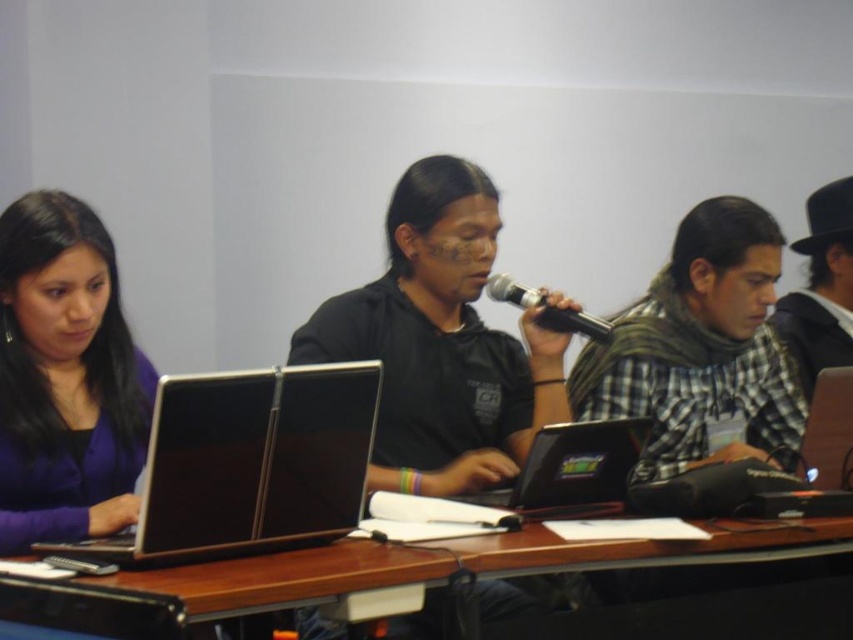
Does wooden table at center have a greater height compared to checkered fabric shirt at right?

Incorrect, wooden table at center's height is not larger of checkered fabric shirt at right's.

Does point (766, 538) lie in front of point (819, 196)?

Yes, point (766, 538) is in front of point (819, 196).

Find the location of a particular element. The width and height of the screenshot is (853, 640). wooden table at center is located at coordinates (448, 563).

Which is below, black matte shirt at center or black matte microphone at center?

black matte shirt at center is lower down.

Does point (355, 298) lie behind point (587, 317)?

That is True.

The height and width of the screenshot is (640, 853). I want to click on black matte shirt at center, so click(x=440, y=342).

Where is `checkered fabric scarf at right`? The height and width of the screenshot is (640, 853). checkered fabric scarf at right is located at coordinates (701, 349).

Based on the photo, is checkered fabric scarf at right smaller than black matte microphone at center?

Actually, checkered fabric scarf at right might be larger than black matte microphone at center.

Find the location of a particular element. This screenshot has height=640, width=853. checkered fabric scarf at right is located at coordinates (701, 349).